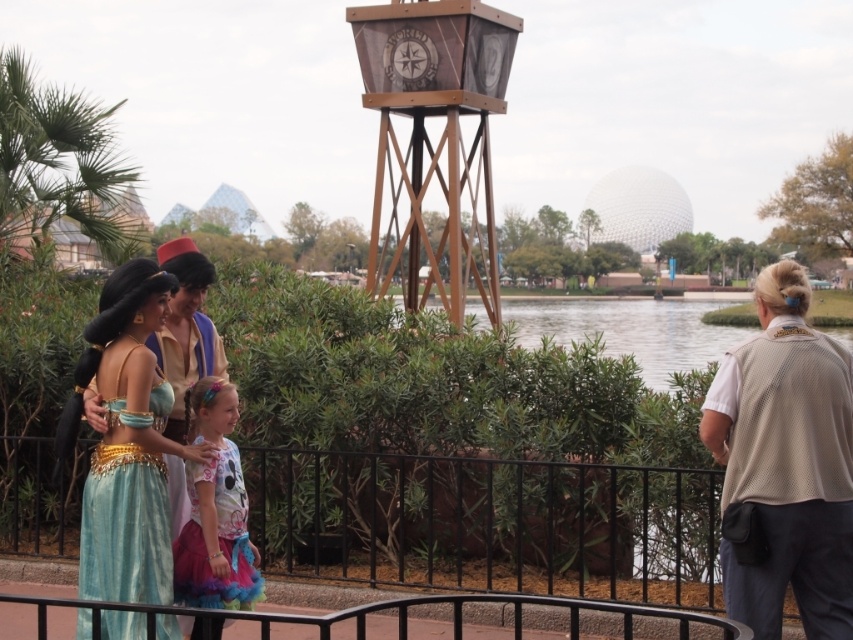
Question: Observing the image, what is the correct spatial positioning of metallic silver railing at center in reference to teal satin dress at center?

Choices:
 (A) left
 (B) right

Answer: (B)

Question: Which point appears farthest from the camera in this image?

Choices:
 (A) (822, 496)
 (B) (190, 486)
 (C) (407, 179)
 (D) (418, 524)

Answer: (C)

Question: Which object appears closest to the camera in this image?

Choices:
 (A) teal velvet dress at left
 (B) black metal fence at lower center
 (C) wooden water tower at center

Answer: (A)

Question: Can you confirm if black metal fence at lower center is smaller than teal satin dress at center?

Choices:
 (A) yes
 (B) no

Answer: (B)

Question: Estimate the real-world distances between objects in this image. Which object is closer to the teal satin dress at center?

Choices:
 (A) wooden water tower at center
 (B) pastel floral dress at center
 (C) beige mesh vest at right
 (D) metallic silver railing at center

Answer: (B)

Question: Is black metal fence at lower center behind metallic silver railing at center?

Choices:
 (A) no
 (B) yes

Answer: (B)